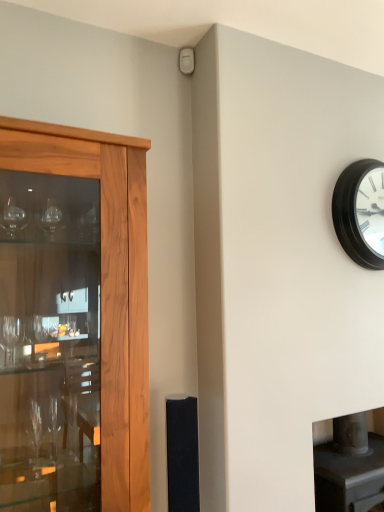
Question: From the image's perspective, does black matte clock at upper right appear lower than wooden cabinet at left?

Choices:
 (A) yes
 (B) no

Answer: (B)

Question: Is black matte clock at upper right facing away from wooden cabinet at left?

Choices:
 (A) yes
 (B) no

Answer: (B)

Question: Is black matte clock at upper right placed right next to wooden cabinet at left?

Choices:
 (A) no
 (B) yes

Answer: (A)

Question: Considering the relative sizes of black matte clock at upper right and wooden cabinet at left in the image provided, is black matte clock at upper right thinner than wooden cabinet at left?

Choices:
 (A) no
 (B) yes

Answer: (B)

Question: Could wooden cabinet at left be considered to be inside black matte clock at upper right?

Choices:
 (A) yes
 (B) no

Answer: (B)

Question: Looking at the image, does black matte speaker at center seem bigger or smaller compared to black matte clock at upper right?

Choices:
 (A) small
 (B) big

Answer: (A)

Question: From a real-world perspective, is black matte speaker at center above or below black matte clock at upper right?

Choices:
 (A) below
 (B) above

Answer: (A)

Question: Is point (177, 439) positioned closer to the camera than point (344, 206)?

Choices:
 (A) closer
 (B) farther

Answer: (A)

Question: Considering the positions of black matte speaker at center and black matte clock at upper right in the image, is black matte speaker at center wider or thinner than black matte clock at upper right?

Choices:
 (A) thin
 (B) wide

Answer: (B)

Question: From the image's perspective, is black matte clock at upper right located above or below wooden cabinet at left?

Choices:
 (A) below
 (B) above

Answer: (B)

Question: Does point (370, 225) appear closer or farther from the camera than point (119, 402)?

Choices:
 (A) closer
 (B) farther

Answer: (B)

Question: From a real-world perspective, is black matte clock at upper right positioned above or below wooden cabinet at left?

Choices:
 (A) above
 (B) below

Answer: (A)

Question: Is black matte clock at upper right bigger or smaller than wooden cabinet at left?

Choices:
 (A) small
 (B) big

Answer: (A)

Question: In terms of height, does black matte clock at upper right look taller or shorter compared to black matte speaker at center?

Choices:
 (A) short
 (B) tall

Answer: (B)

Question: Based on their sizes in the image, would you say black matte clock at upper right is bigger or smaller than black matte speaker at center?

Choices:
 (A) small
 (B) big

Answer: (B)